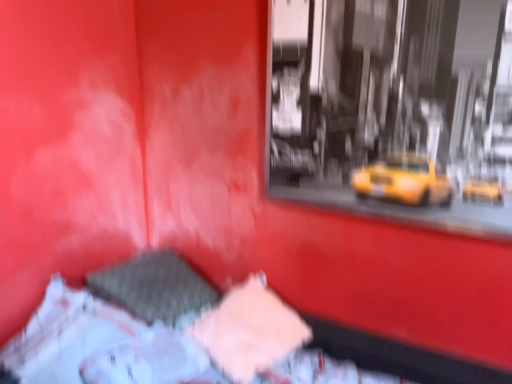
Question: Based on their positions, is textured fabric bed at center located to the left or right of pink fabric at center?

Choices:
 (A) right
 (B) left

Answer: (B)

Question: Is textured fabric bed at center bigger or smaller than pink fabric at center?

Choices:
 (A) small
 (B) big

Answer: (B)

Question: From a real-world perspective, relative to pink fabric at center, is textured fabric bed at center vertically above or below?

Choices:
 (A) above
 (B) below

Answer: (A)

Question: From a real-world perspective, is pink fabric at center positioned above or below textured fabric bed at center?

Choices:
 (A) below
 (B) above

Answer: (A)

Question: Based on their positions, is pink fabric at center located to the left or right of textured fabric bed at center?

Choices:
 (A) right
 (B) left

Answer: (A)

Question: From the image's perspective, is pink fabric at center located above or below textured fabric bed at center?

Choices:
 (A) above
 (B) below

Answer: (A)

Question: Considering their positions, is pink fabric at center located in front of or behind textured fabric bed at center?

Choices:
 (A) behind
 (B) front

Answer: (A)